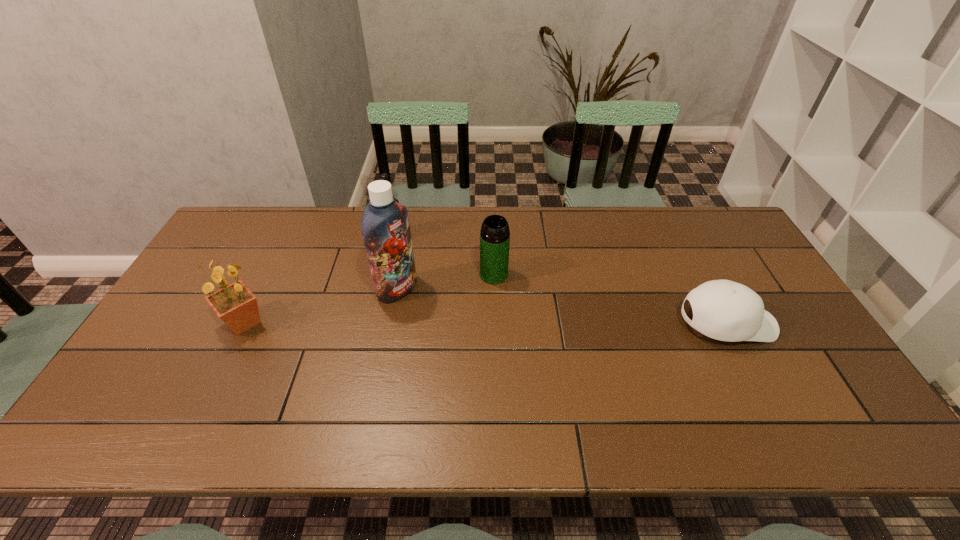
Identify the location of unoccupied area between the tallest object and the leftmost object. (321, 306).

In order to click on vacant region between the leftmost object and the thermos bottle in this screenshot , I will do `click(369, 298)`.

Where is `free space between the rightmost object and the shampoo`? This screenshot has width=960, height=540. free space between the rightmost object and the shampoo is located at coordinates 562,306.

Find the location of a particular element. This screenshot has height=540, width=960. free spot between the thermos bottle and the shampoo is located at coordinates (445, 282).

At what (x,y) coordinates should I click in order to perform the action: click on vacant area that lies between the shampoo and the thermos bottle. Please return your answer as a coordinate pair (x, y). Looking at the image, I should click on (445, 282).

You are a GUI agent. You are given a task and a screenshot of the screen. Output one action in this format:
    pyautogui.click(x=<x>, y=<y>)
    Task: Click on the second closest object to the vodka
    This screenshot has height=540, width=960.
    Given the screenshot: What is the action you would take?
    pyautogui.click(x=495, y=235)

Identify which object is located as the second nearest to the shampoo. Please provide its 2D coordinates. Your answer should be formatted as a tuple, i.e. [(x, y)], where the tuple contains the x and y coordinates of a point satisfying the conditions above.

[(495, 235)]

Identify the location of free point that satisfies the following two spatial constraints: 1. on the front side of the tallest object; 2. on the right side of the farthest object. (382, 289).

This screenshot has width=960, height=540. What are the coordinates of `vacant space that satisfies the following two spatial constraints: 1. on the front side of the baseball cap; 2. on the front-facing side of the tallest object` in the screenshot? It's located at (391, 323).